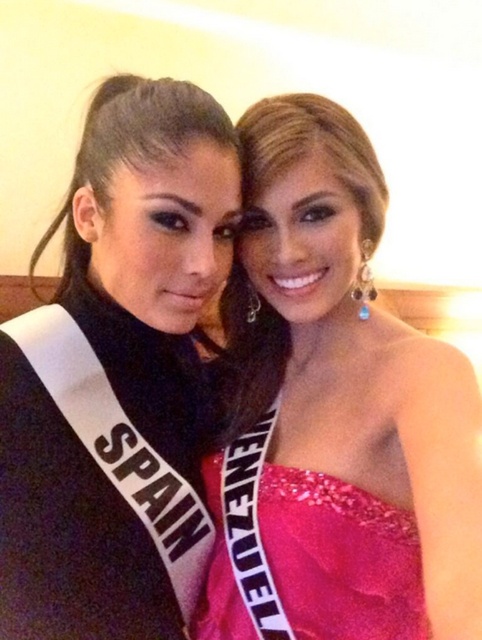
You are a photographer trying to capture a clear shot of both women. You notice two points of interest marked at coordinates point (311, 353) and point (206, 246). Which point is closer to the camera?

Point (206, 246) is closer to the camera because it is in front of point (311, 353).

In the scene shown: You are a photographer setting up for a group photo. You have two models wearing the pink satin dress at center and the pink sequined dress at center. The camera frame is only wide enough to fit the narrower of the two dresses. Which dress should the model wearing it choose to ensure they fit within the frame?

The pink sequined dress at center is narrower than the pink satin dress at center, so the model wearing the pink sequined dress at center should choose it to fit within the frame.